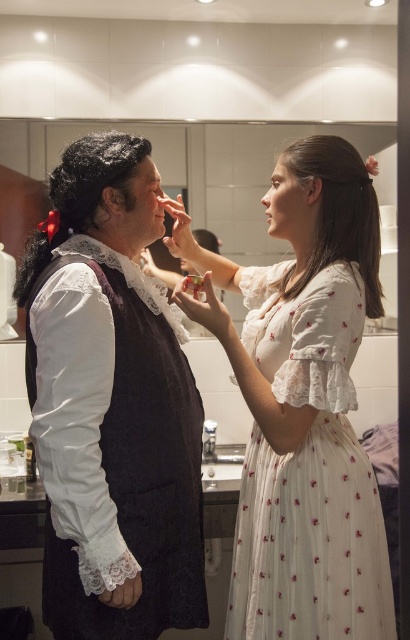
Question: Can you confirm if white floral fabric dress at center is bigger than matte black face at upper center?

Choices:
 (A) yes
 (B) no

Answer: (A)

Question: Which is nearer to the matte black vest at left?

Choices:
 (A) white floral fabric dress at center
 (B) smooth skin face at upper right

Answer: (A)

Question: Can you confirm if glossy white mirror at upper center is thinner than smooth skin face at upper right?

Choices:
 (A) yes
 (B) no

Answer: (B)

Question: Which point appears closest to the camera in this image?

Choices:
 (A) (268, 227)
 (B) (134, 483)

Answer: (B)

Question: Does glossy white mirror at upper center have a smaller size compared to dark brown silky hair at upper right?

Choices:
 (A) yes
 (B) no

Answer: (B)

Question: Which of the following is the farthest from the observer?

Choices:
 (A) matte black face at upper center
 (B) glossy white mirror at upper center
 (C) white floral fabric dress at center
 (D) dark brown silky hair at upper right

Answer: (B)